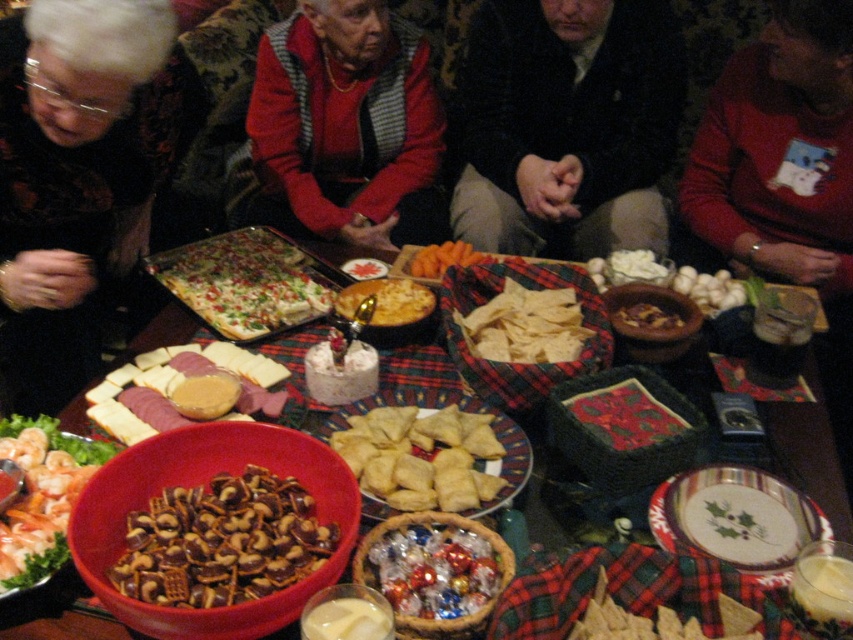
Question: Can you confirm if chocolate-covered pretzels at center is positioned to the right of white cheese at center?

Choices:
 (A) no
 (B) yes

Answer: (B)

Question: Which object is positioned farthest from the golden crispy chips at center?

Choices:
 (A) porcelain plate with holly design at center
 (B) brown crumbly cake at center

Answer: (A)

Question: Which point is farther to the camera?

Choices:
 (A) white creamy mushrooms at center
 (B) golden crispy chips at center
 (C) porcelain plate with holly design at center

Answer: (A)

Question: Is matte plastic bowl at center to the left of white creamy mushrooms at center from the viewer's perspective?

Choices:
 (A) yes
 (B) no

Answer: (A)

Question: Is dark brown leather jacket at center positioned at the back of shiny foil-wrapped candies at center?

Choices:
 (A) yes
 (B) no

Answer: (A)

Question: Among these points, which one is farthest from the camera?

Choices:
 (A) (253, 384)
 (B) (433, 275)
 (C) (491, 157)
 (D) (751, 624)

Answer: (C)